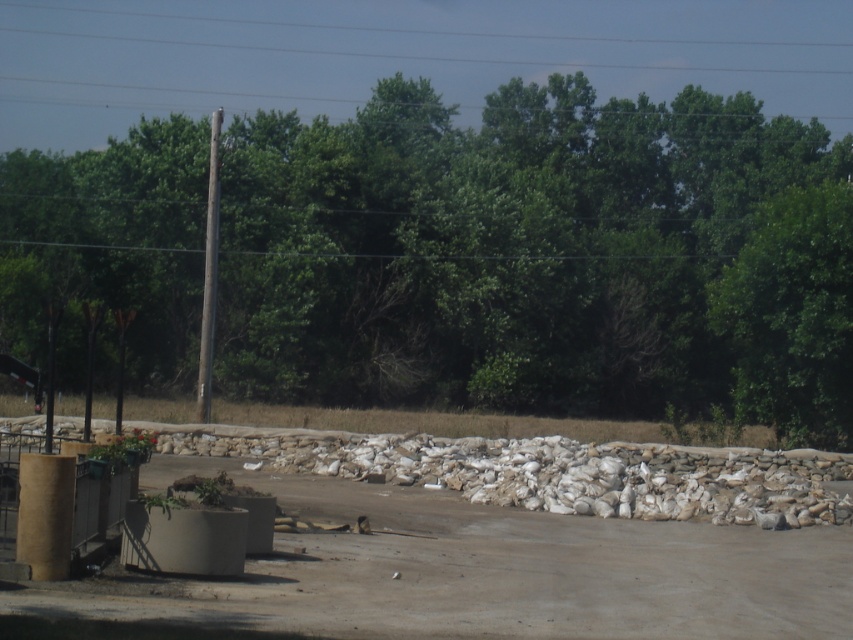
Which is above, dirt track at center or brown wooden pole at left?

Positioned higher is brown wooden pole at left.

Measure the distance from dirt track at center to brown wooden pole at left.

They are 17.29 meters apart.

Is point (773, 477) positioned after point (206, 342)?

No, (773, 477) is closer to viewer.

At what (x,y) coordinates should I click in order to perform the action: click on dirt track at center. Please return your answer as a coordinate pair (x, y). Looking at the image, I should click on (514, 545).

Does green leafy tree at upper center appear under dirt track at center?

No, green leafy tree at upper center is not below dirt track at center.

Can you confirm if green leafy tree at upper center is positioned above dirt track at center?

Yes, green leafy tree at upper center is above dirt track at center.

Does point (828, 394) come closer to viewer compared to point (822, 492)?

No, (828, 394) is behind (822, 492).

The height and width of the screenshot is (640, 853). In order to click on green leafy tree at upper center in this screenshot , I will do `click(541, 257)`.

Can you confirm if green leafy tree at upper center is taller than brown wooden pole at left?

Yes.

Is point (635, 244) farther from camera compared to point (213, 230)?

Yes, point (635, 244) is behind point (213, 230).

The image size is (853, 640). Find the location of `green leafy tree at upper center`. green leafy tree at upper center is located at coordinates (541, 257).